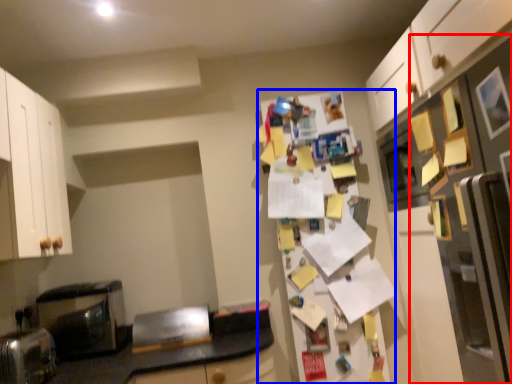
Question: Which object is closer to the camera taking this photo, fridge (highlighted by a red box) or fridge (highlighted by a blue box)?

Choices:
 (A) fridge
 (B) fridge

Answer: (A)